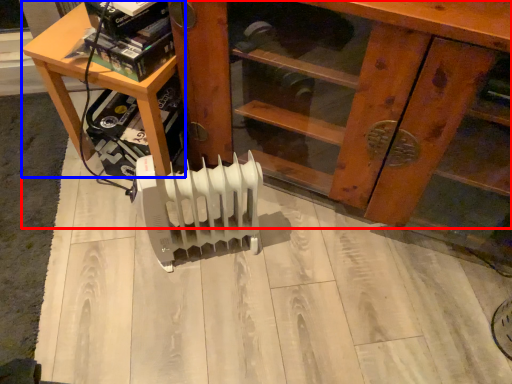
Question: Which object is closer to the camera taking this photo, furniture (highlighted by a red box) or table (highlighted by a blue box)?

Choices:
 (A) furniture
 (B) table

Answer: (A)